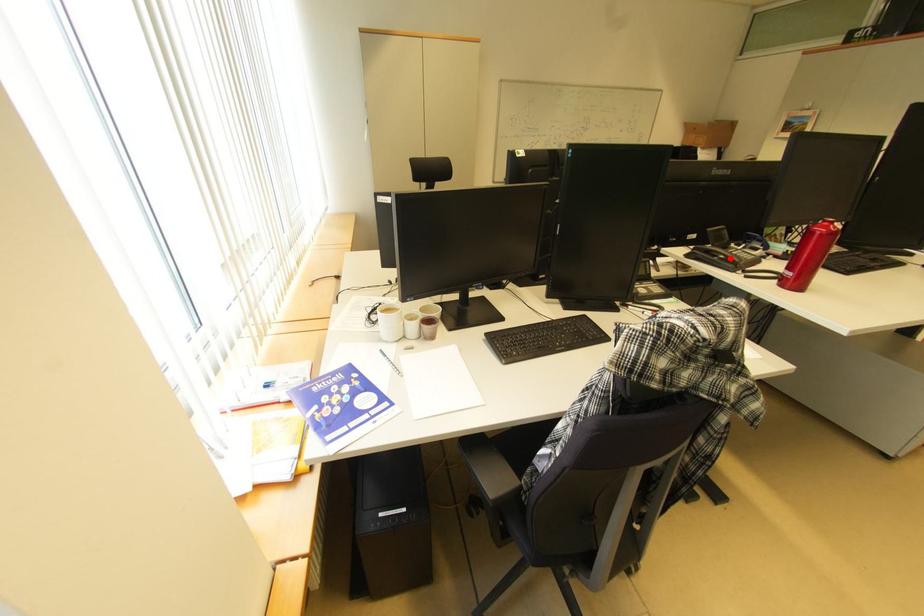
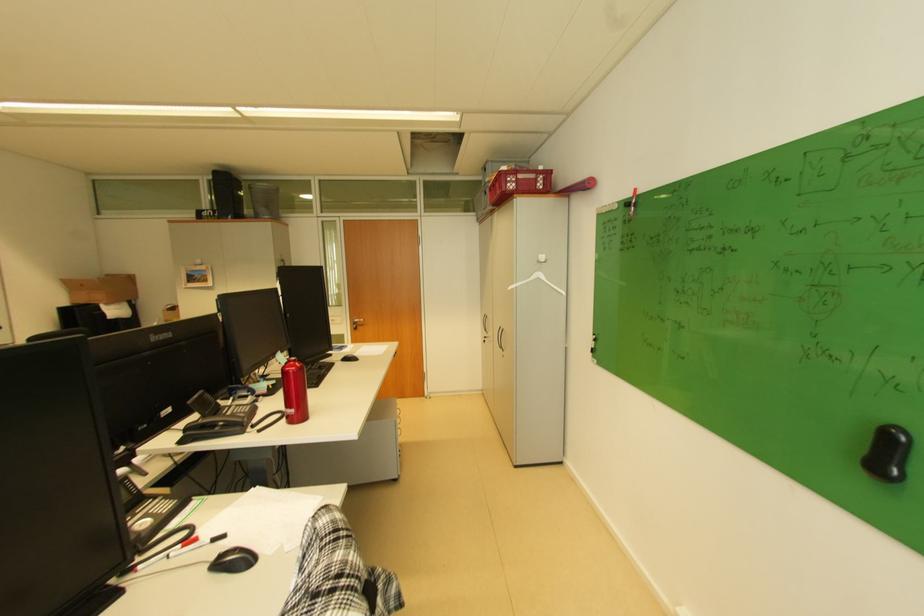
The point at the highlighted location is marked in the first image. Where is the corresponding point in the second image?

(229, 424)